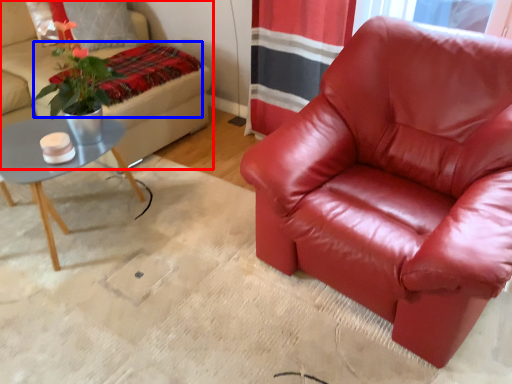
Question: Which point is further to the camera, studio couch (highlighted by a red box) or blanket (highlighted by a blue box)?

Choices:
 (A) studio couch
 (B) blanket

Answer: (B)